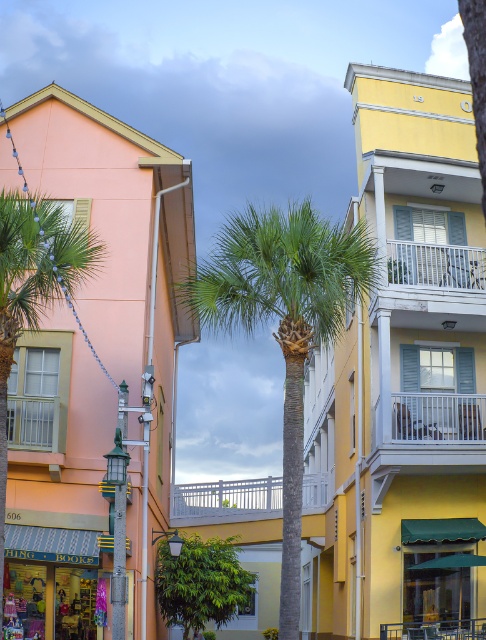
Which is more to the right, white metal balcony at center-right or green leafy tree at center?

white metal balcony at center-right is more to the right.

This screenshot has width=486, height=640. Describe the element at coordinates (429, 433) in the screenshot. I see `white metal balcony at center-right` at that location.

The image size is (486, 640). I want to click on white metal balcony at center-right, so click(x=429, y=433).

Is matte pink building at left positioned before green leafy tree at center?

Yes, matte pink building at left is closer to the viewer.

What do you see at coordinates (122, 268) in the screenshot? The image size is (486, 640). I see `matte pink building at left` at bounding box center [122, 268].

The width and height of the screenshot is (486, 640). I want to click on matte pink building at left, so click(122, 268).

Can you confirm if green leafy palm tree at left is taller than green leafy tree at center?

Yes.

Which is more to the right, green leafy palm tree at left or green leafy tree at center?

From the viewer's perspective, green leafy tree at center appears more on the right side.

Does point (72, 273) come closer to viewer compared to point (208, 572)?

Yes, it is.

I want to click on green leafy palm tree at left, so click(x=34, y=282).